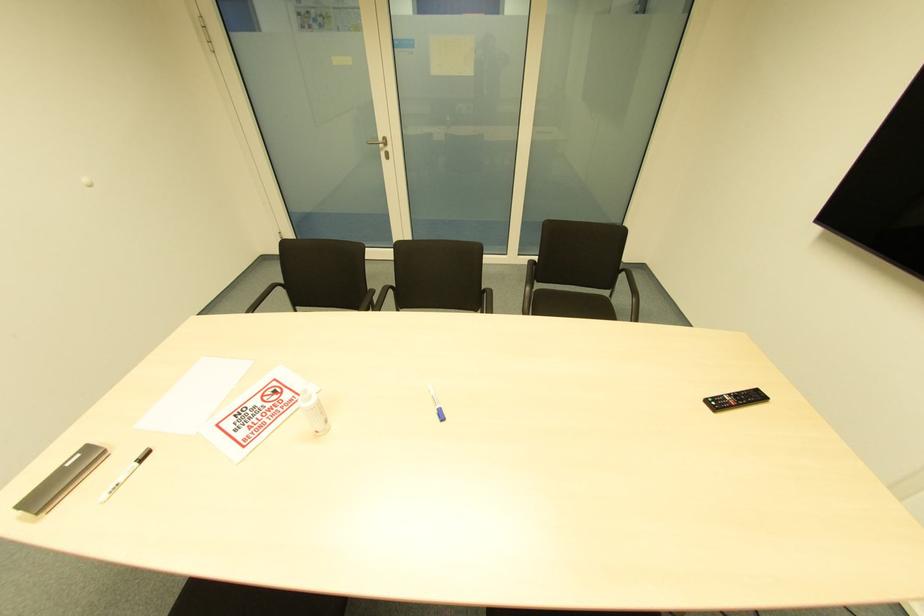
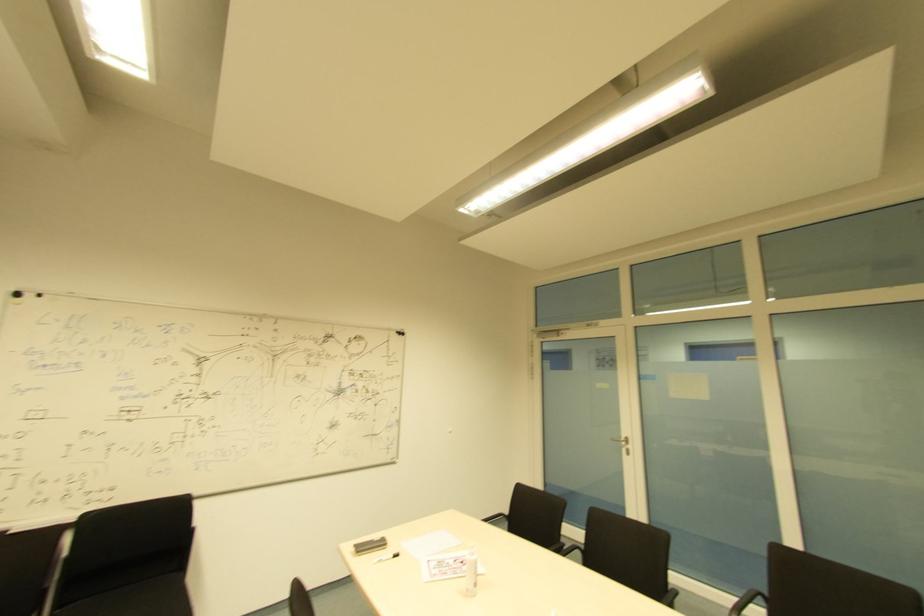
Locate, in the second image, the point that corresponds to (137,456) in the first image.

(394, 554)